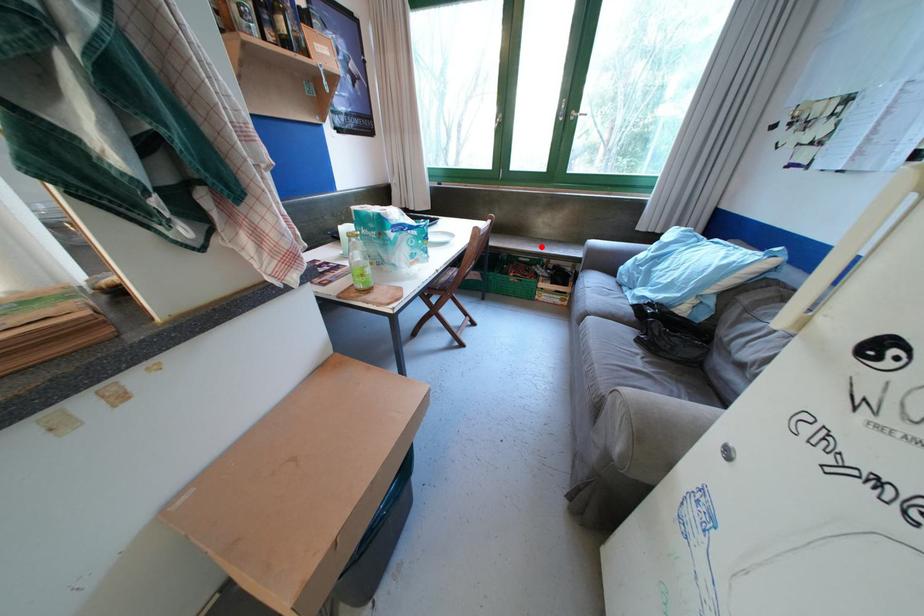
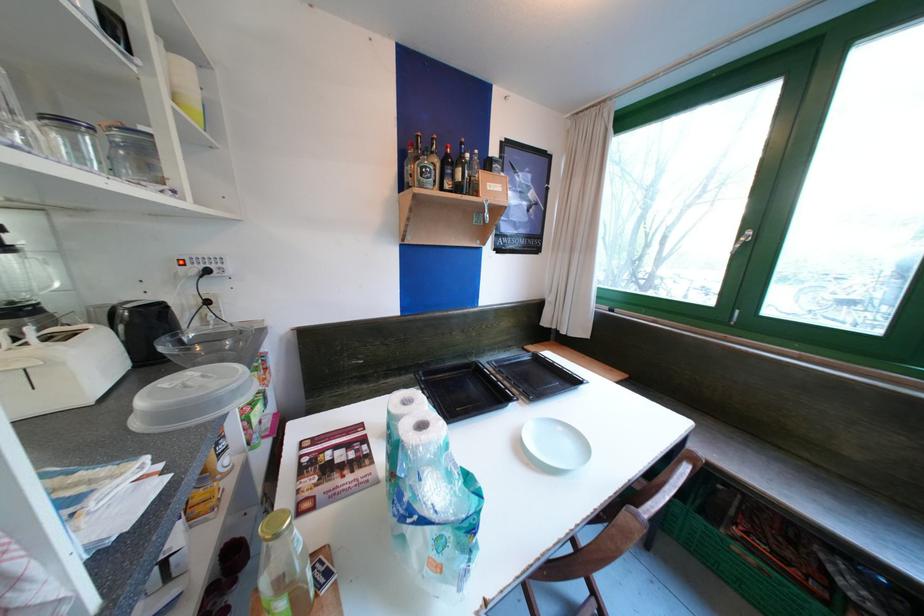
Question: I am providing you with two images of the same scene from different viewpoints. In image1, a red point is highlighted. Considering the same 3D point in image2, which of the following is correct?

Choices:
 (A) It is closer
 (B) It is farther

Answer: (B)